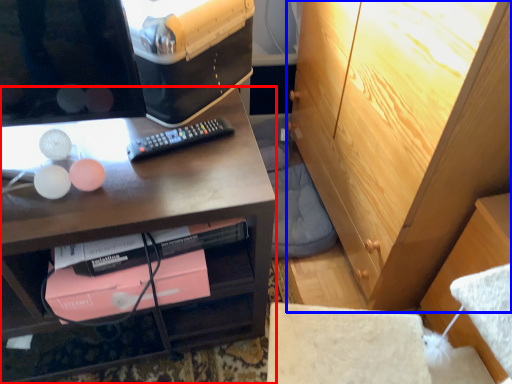
Question: Which object appears farthest to the camera in this image, desk (highlighted by a red box) or cabinetry (highlighted by a blue box)?

Choices:
 (A) desk
 (B) cabinetry

Answer: (B)